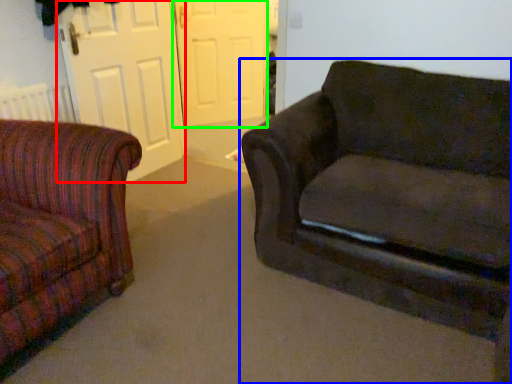
Question: Which object is positioned closest to screen door (highlighted by a red box)? Select from studio couch (highlighted by a blue box) and screen door (highlighted by a green box).

Choices:
 (A) studio couch
 (B) screen door

Answer: (B)